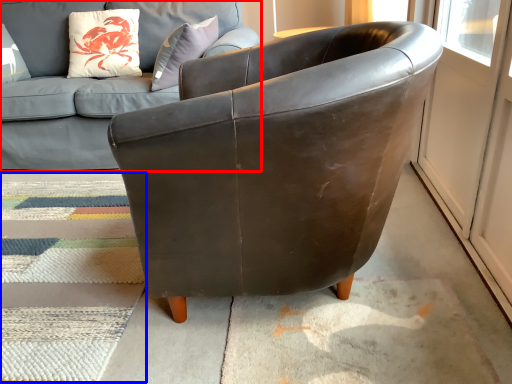
Question: Which object appears closest to the camera in this image, studio couch (highlighted by a red box) or mat (highlighted by a blue box)?

Choices:
 (A) studio couch
 (B) mat

Answer: (B)